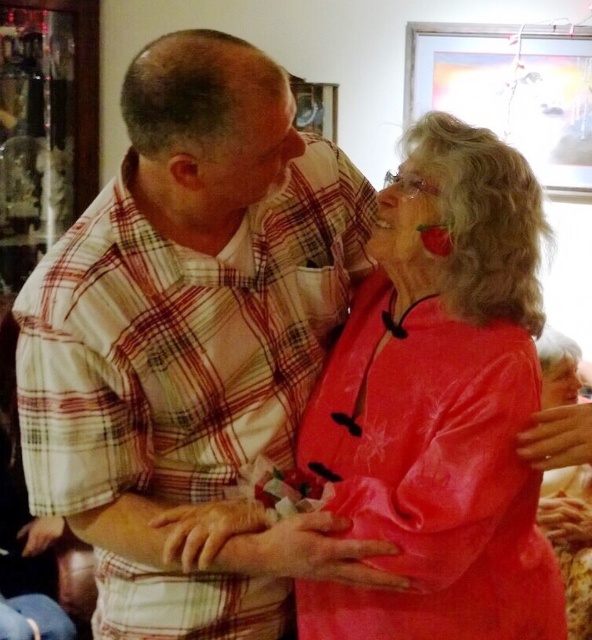
You are a photographer trying to capture a closeup of the smooth skin face at center without including the matte plaid shirt at upper center in the frame. Is this possible given their positions?

The matte plaid shirt at upper center is much taller than the smooth skin face at center, so it would block part of the face. Therefore, capturing a closeup without including the matte plaid shirt at upper center might not be possible.

You are a photographer trying to capture the scene. You notice the matte plaid shirt at upper center and the smooth skin face at center. Which object is positioned to the left of the other?

The matte plaid shirt at upper center is to the left of the smooth skin face at center.